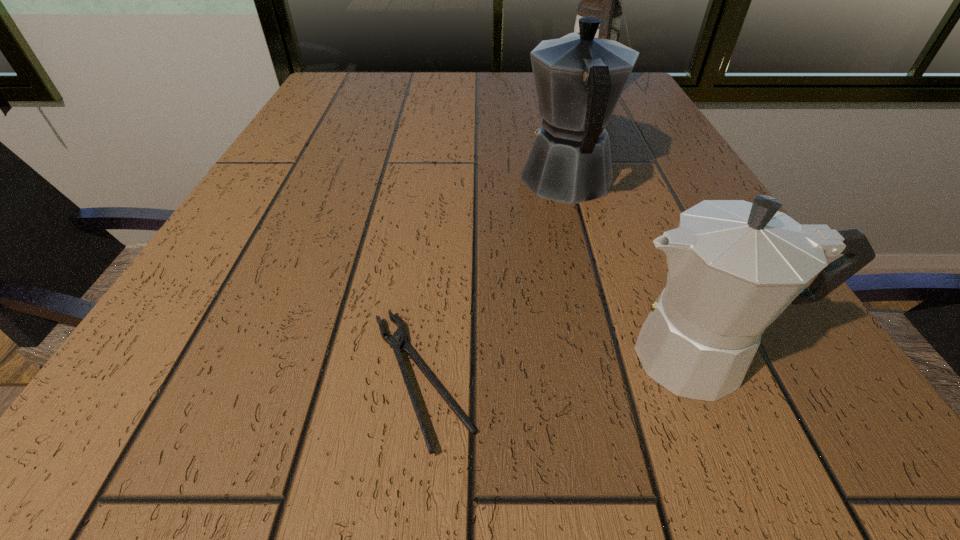
Locate an element on the screen. free space located 0.100m at the spout of the third shortest object is located at coordinates (553, 126).

You are a GUI agent. You are given a task and a screenshot of the screen. Output one action in this format:
    pyautogui.click(x=<x>, y=<y>)
    Task: Click on the free spot located 0.080m at the spout of the third shortest object
    
    Given the screenshot: What is the action you would take?
    pyautogui.click(x=554, y=131)

Where is `free location located 0.250m at the spout of the shorter coffeepot`? free location located 0.250m at the spout of the shorter coffeepot is located at coordinates (396, 356).

Where is `free space located 0.070m at the spout of the shorter coffeepot`? The image size is (960, 540). free space located 0.070m at the spout of the shorter coffeepot is located at coordinates (555, 356).

I want to click on blank space located 0.330m at the spout of the shorter coffeepot, so click(x=326, y=356).

In order to click on vacant space situated 0.080m on the back of the tongs in this screenshot , I will do `click(433, 272)`.

The image size is (960, 540). I want to click on object that is at the far edge, so click(x=601, y=0).

Find the location of a particular element. Image resolution: width=960 pixels, height=540 pixels. coffeepot at the near edge is located at coordinates (733, 266).

Image resolution: width=960 pixels, height=540 pixels. I want to click on tongs that is at the near edge, so click(396, 341).

Find the location of a particular element. The height and width of the screenshot is (540, 960). oil lamp located in the right edge section of the desktop is located at coordinates (601, 0).